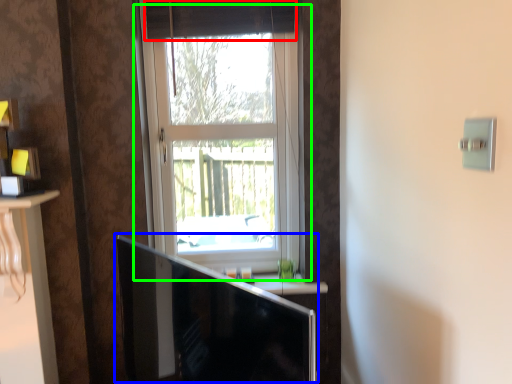
Question: Which object is the closest to the curtain (highlighted by a red box)? Choose among these: computer monitor (highlighted by a blue box) or window (highlighted by a green box).

Choices:
 (A) computer monitor
 (B) window

Answer: (B)